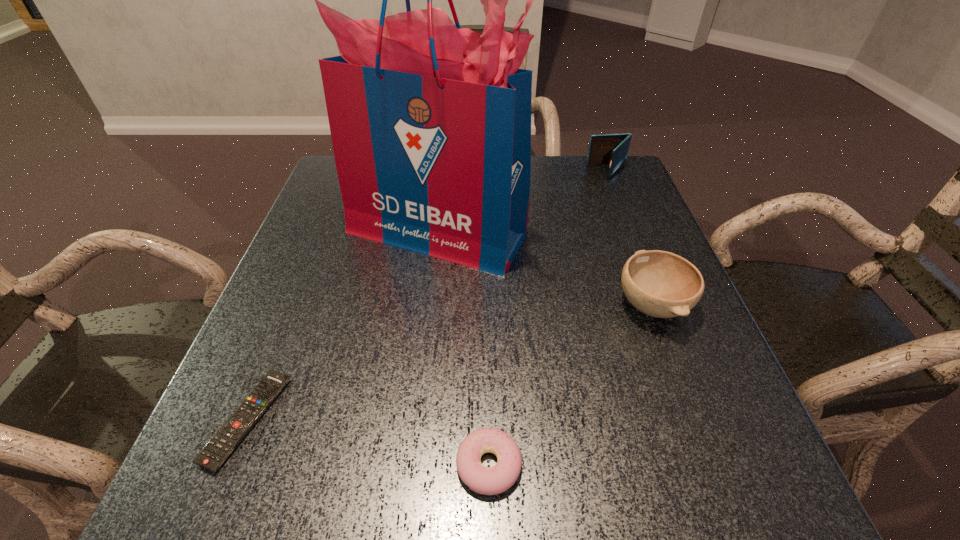
Where is `grocery bag`? The image size is (960, 540). grocery bag is located at coordinates (430, 123).

Identify the location of wallet. The image size is (960, 540). (612, 149).

Find the location of `bowl`. bowl is located at coordinates (660, 284).

Image resolution: width=960 pixels, height=540 pixels. In order to click on doughnut in this screenshot , I will do `click(493, 480)`.

Locate an element on the screen. The width and height of the screenshot is (960, 540). remote control is located at coordinates (215, 453).

Find the location of a particular element. This screenshot has height=540, width=960. the shortest object is located at coordinates (215, 453).

Locate an element on the screen. This screenshot has width=960, height=540. free space located on the front-facing side of the grocery bag is located at coordinates (429, 301).

Find the location of a particular element. vacant region located on the exterior surface of the farthest object is located at coordinates coord(482,172).

Find the location of a particular element. The height and width of the screenshot is (540, 960). free region located on the exterior surface of the farthest object is located at coordinates (560, 172).

Find the location of a particular element. The height and width of the screenshot is (540, 960). vacant area situated 0.210m on the exterior surface of the farthest object is located at coordinates (514, 172).